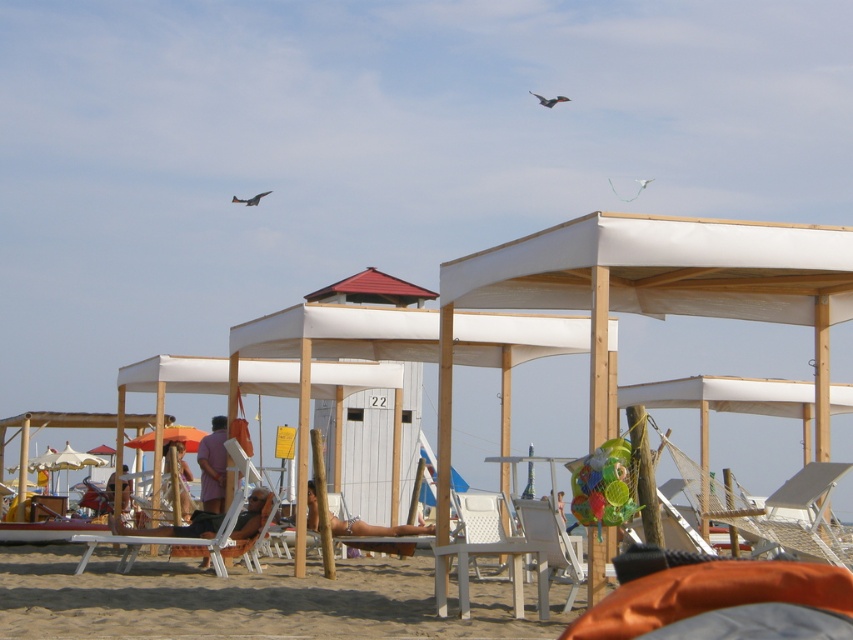
You are standing at the beach and see two points marked on the sand. The first point is at point (x=51, y=616) and the second is at point (x=202, y=563). Which point is closer to you?

Point (x=51, y=616) is closer to the camera than point (x=202, y=563).

You are a beachgoer looking for a place to sit. You see a white plastic chair at center and a wooden lounge chair at center. Which one is positioned lower to the ground?

The white plastic chair at center is positioned lower to the ground because it is below the wooden lounge chair at center.

You are a beachgoer looking for a place to sit. You see a white plastic chair at center and a wooden lounge chair at center. Which chair is to the right when facing the beach?

The white plastic chair at center is positioned on the right side of the wooden lounge chair at center, so when facing the beach, the white plastic chair at center is to the right of the wooden lounge chair at center.